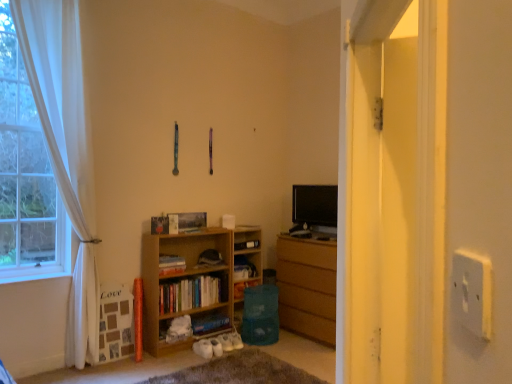
Question: Does point (224, 326) appear closer or farther from the camera than point (331, 192)?

Choices:
 (A) closer
 (B) farther

Answer: (A)

Question: Would you say hardcover book at lower center, positioned as the 3th book in top-to-bottom order, is inside or outside black glossy tv at center?

Choices:
 (A) outside
 (B) inside

Answer: (A)

Question: Which object is positioned closest to the black glossy tv at center?

Choices:
 (A) white sheer curtain at left
 (B) light brown wood bookcase at lower left
 (C) wooden bookshelf at center
 (D) wooden bookshelf at center, which is the 2th book from top to bottom
 (E) transparent plastic screen door at right

Answer: (C)

Question: Estimate the real-world distances between objects in this image. Which object is closer to the wooden chest of drawers at center?

Choices:
 (A) hardcover book at center, which is counted as the third book, starting from the bottom
 (B) hardcover book at lower center, arranged as the first book when ordered from the bottom
 (C) white plastic electric outlet at right
 (D) wooden bookshelf at center, placed as the 2th book when sorted from bottom to top
 (E) transparent plastic screen door at right

Answer: (B)